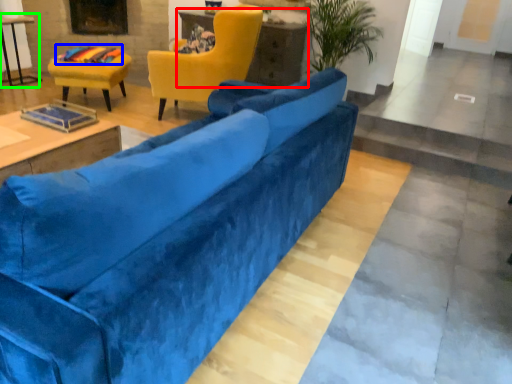
Question: Based on their relative distances, which object is nearer to table (highlighted by a red box)? Choose from material (highlighted by a blue box) and table (highlighted by a green box).

Choices:
 (A) material
 (B) table

Answer: (A)